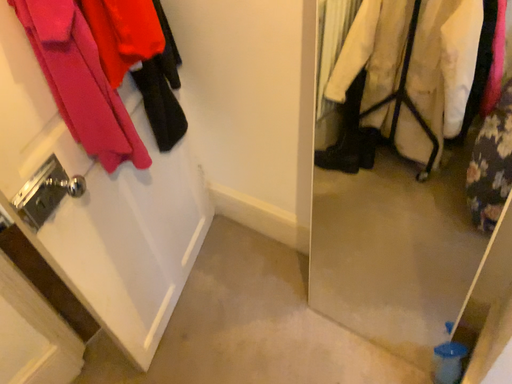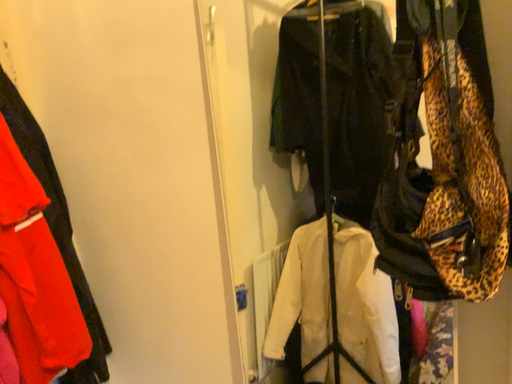
Question: How did the camera likely rotate when shooting the video?

Choices:
 (A) rotated right
 (B) rotated left

Answer: (A)